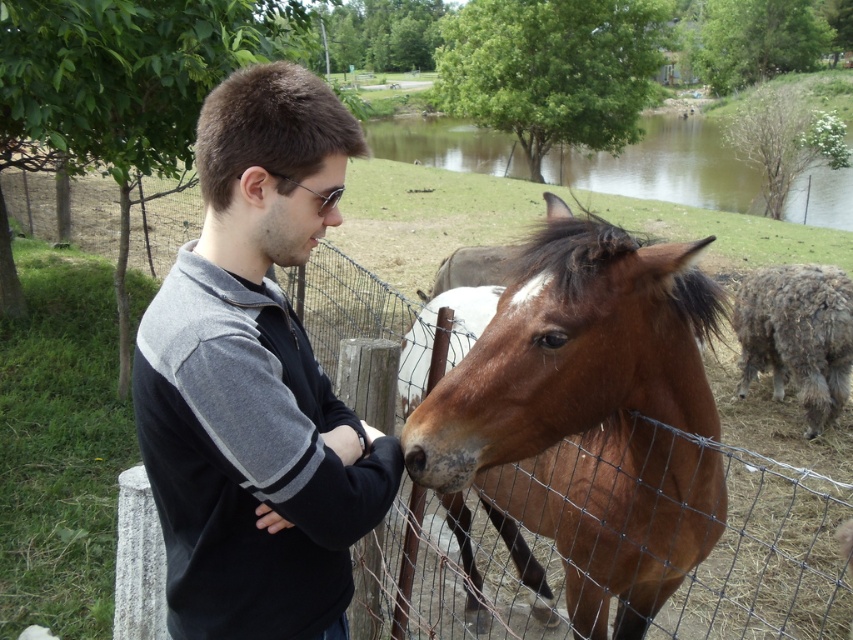
Is brown glossy horse at center smaller than fuzzy gray sheep at right?

No, brown glossy horse at center is not smaller than fuzzy gray sheep at right.

Is brown glossy horse at center bigger than fuzzy gray sheep at right?

Correct, brown glossy horse at center is larger in size than fuzzy gray sheep at right.

Who is more distant from viewer, (709,458) or (746,317)?

The point (746,317) is more distant.

Identify the location of brown glossy horse at center. (581, 420).

Which is in front, point (183, 413) or point (753, 301)?

Point (183, 413)

Can you confirm if black fleece jacket at center is shorter than fuzzy gray sheep at right?

Yes.

The width and height of the screenshot is (853, 640). In order to click on black fleece jacket at center in this screenshot , I will do `click(256, 380)`.

Where is `black fleece jacket at center`? black fleece jacket at center is located at coordinates click(x=256, y=380).

From the picture: Is black fleece jacket at center bigger than brown glossy horse at center?

No, black fleece jacket at center is not bigger than brown glossy horse at center.

Identify the location of black fleece jacket at center. The image size is (853, 640). (256, 380).